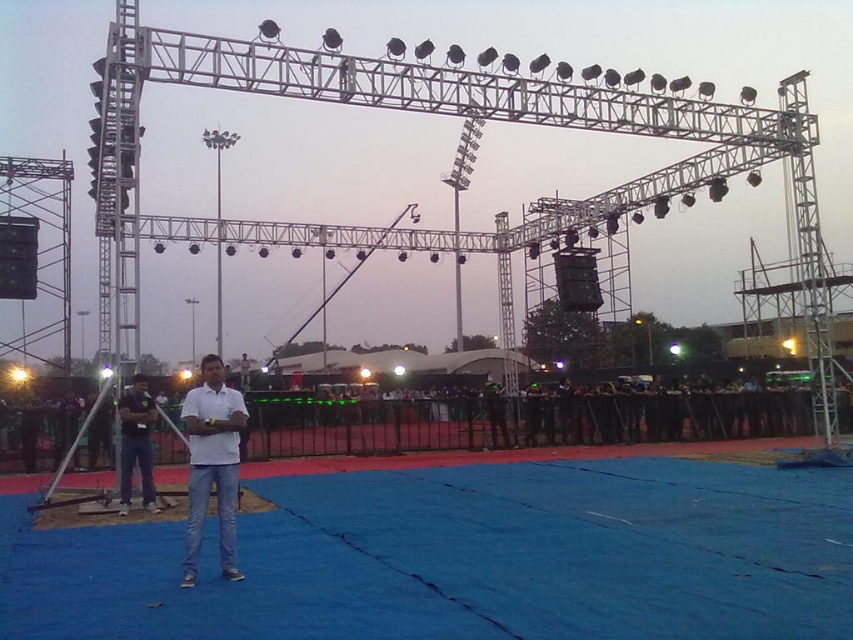
Question: Which point is closer to the camera taking this photo?

Choices:
 (A) (126, 484)
 (B) (227, 554)

Answer: (B)

Question: Can you confirm if blue fabric at center is smaller than white cotton shirt at center?

Choices:
 (A) yes
 (B) no

Answer: (B)

Question: Which object is farther from the camera taking this photo?

Choices:
 (A) dark blue jeans at center
 (B) blue fabric at center

Answer: (A)

Question: Which object is the farthest from the dark blue jeans at center?

Choices:
 (A) white cotton shirt at center
 (B) blue fabric at center

Answer: (B)

Question: Can you confirm if blue fabric at center is bigger than white cotton shirt at center?

Choices:
 (A) no
 (B) yes

Answer: (B)

Question: Is blue fabric at center wider than dark blue jeans at center?

Choices:
 (A) yes
 (B) no

Answer: (A)